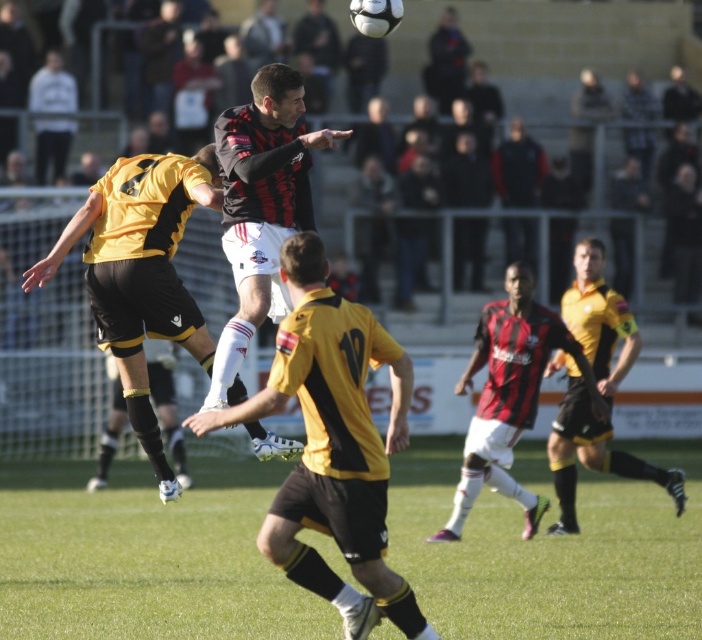
The image size is (702, 640). What do you see at coordinates (140, 273) in the screenshot?
I see `yellow/black jersey at left` at bounding box center [140, 273].

Between yellow/black jersey at left and matte red soccer jersey at center, which one appears on the right side from the viewer's perspective?

From the viewer's perspective, matte red soccer jersey at center appears more on the right side.

What do you see at coordinates (140, 273) in the screenshot? The height and width of the screenshot is (640, 702). I see `yellow/black jersey at left` at bounding box center [140, 273].

Locate an element on the screen. This screenshot has height=640, width=702. yellow/black jersey at left is located at coordinates (140, 273).

Does green grass at center have a lesser height compared to black and red striped jersey at center?

Indeed, green grass at center has a lesser height compared to black and red striped jersey at center.

Between green grass at center and black and red striped jersey at center, which one has more height?

Standing taller between the two is black and red striped jersey at center.

Is point (67, 618) positioned in front of point (258, 196)?

No, (67, 618) is behind (258, 196).

I want to click on green grass at center, so click(145, 557).

Is green grass at center taller than yellow/black jersey at left?

No, green grass at center is not taller than yellow/black jersey at left.

Does point (232, 534) come in front of point (192, 163)?

No, (232, 534) is further to viewer.

The height and width of the screenshot is (640, 702). I want to click on green grass at center, so click(x=145, y=557).